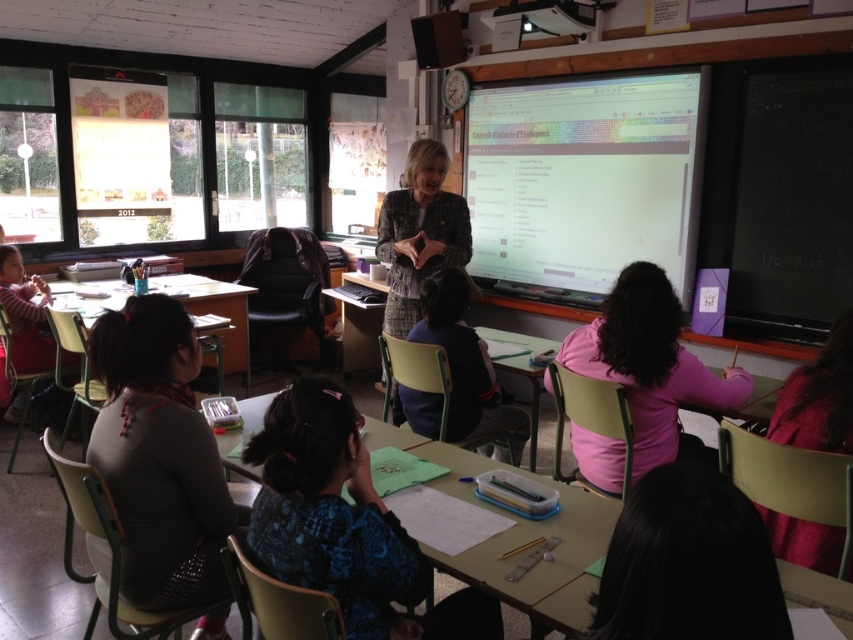
Does dark gray sweater at center appear over pink matte sweater at center?

No, dark gray sweater at center is not above pink matte sweater at center.

Is dark gray sweater at center to the right of pink matte sweater at center from the viewer's perspective?

Incorrect, dark gray sweater at center is not on the right side of pink matte sweater at center.

Where is `dark gray sweater at center`? This screenshot has height=640, width=853. dark gray sweater at center is located at coordinates (160, 456).

Based on the photo, between black chalkboard at right and dark blue fabric at center, which one has more height?

black chalkboard at right

I want to click on black chalkboard at right, so click(x=780, y=195).

The image size is (853, 640). Find the location of `black chalkboard at right`. black chalkboard at right is located at coordinates (780, 195).

Who is more distant from viewer, [451,340] or [244,323]?

Positioned behind is point [244,323].

Which is in front, point (515, 426) or point (248, 390)?

Positioned in front is point (515, 426).

At what (x,y) coordinates should I click in order to perform the action: click on dark blue fabric at center. Please return your answer as a coordinate pair (x, y). The image size is (853, 640). Looking at the image, I should click on (465, 364).